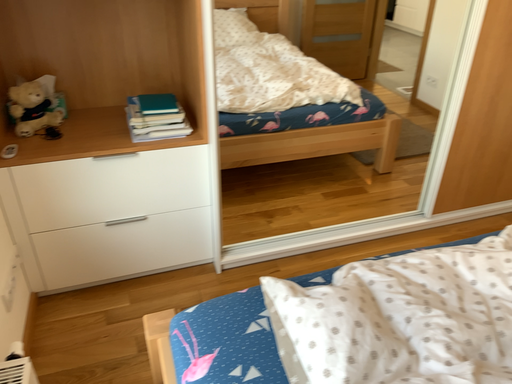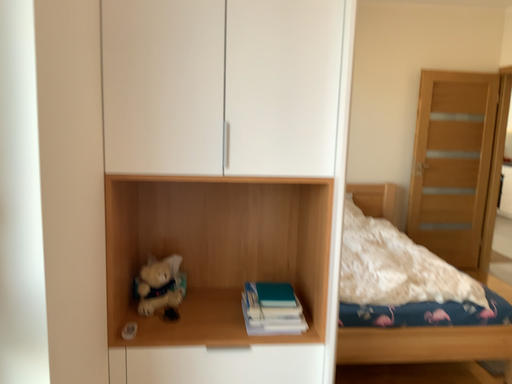
Question: How did the camera likely rotate when shooting the video?

Choices:
 (A) rotated upward
 (B) rotated downward

Answer: (A)